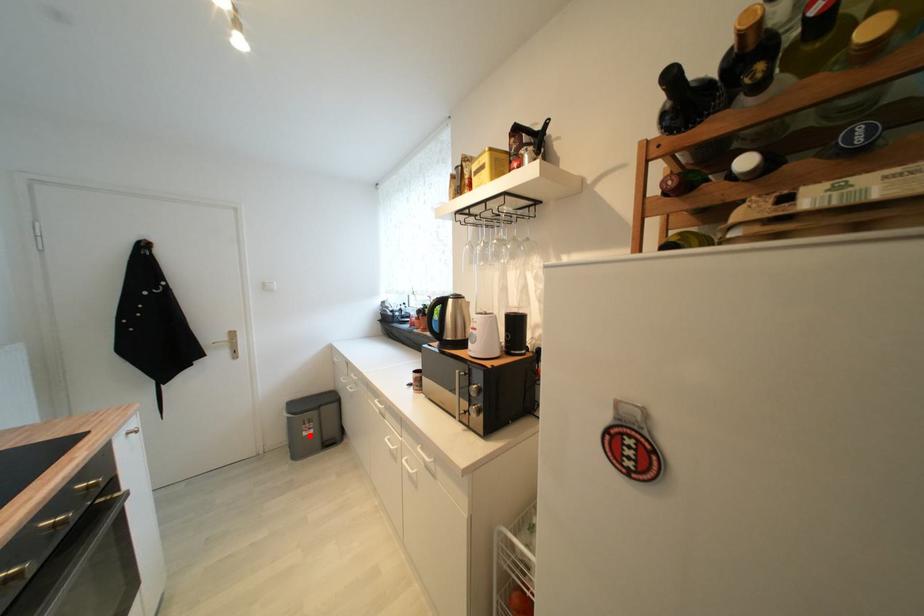
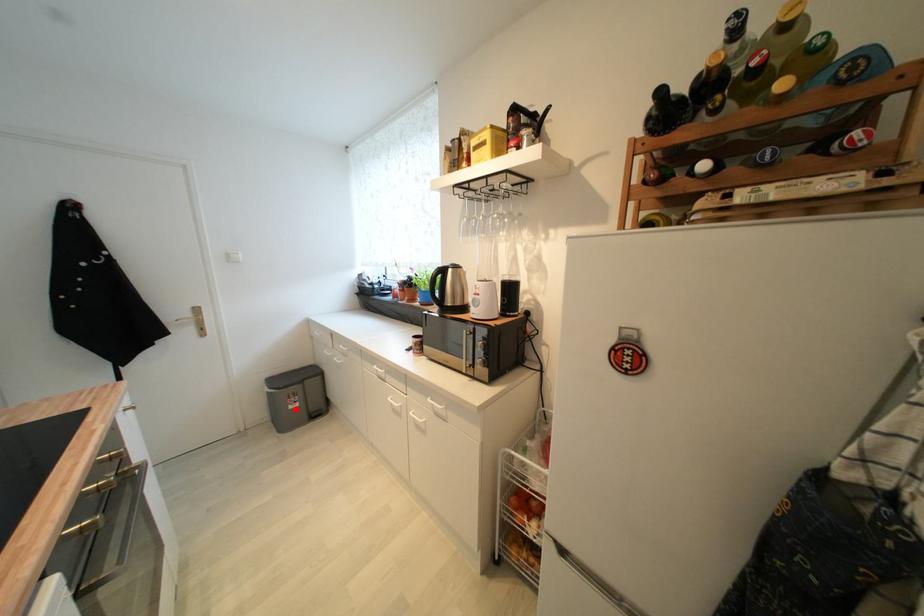
I am providing you with two images of the same scene from different viewpoints. A red point is marked on the first image and another point is marked on the second image. Does the point marked in image1 correspond to the same location as the one in image2?

Yes